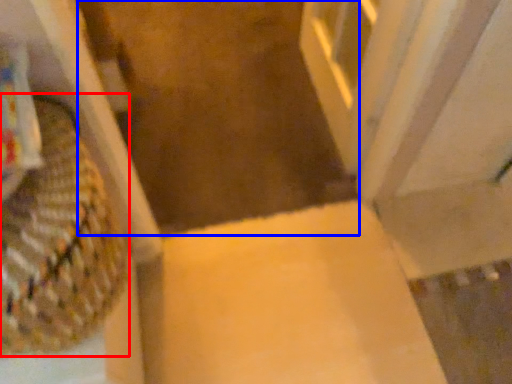
Question: Which object appears closest to the camera in this image, basket (highlighted by a red box) or aisle (highlighted by a blue box)?

Choices:
 (A) basket
 (B) aisle

Answer: (A)